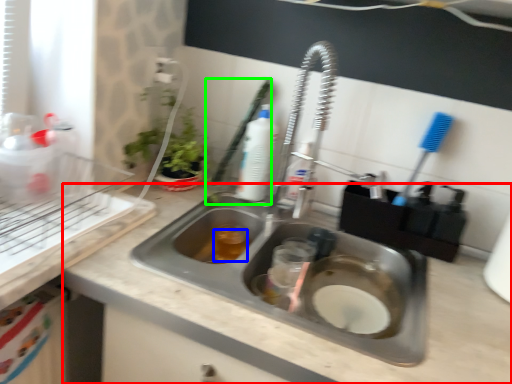
Question: Estimate the real-world distances between objects in this image. Which object is closer to counter top (highlighted by a red box), liquid (highlighted by a blue box) or brush (highlighted by a green box)?

Choices:
 (A) liquid
 (B) brush

Answer: (A)